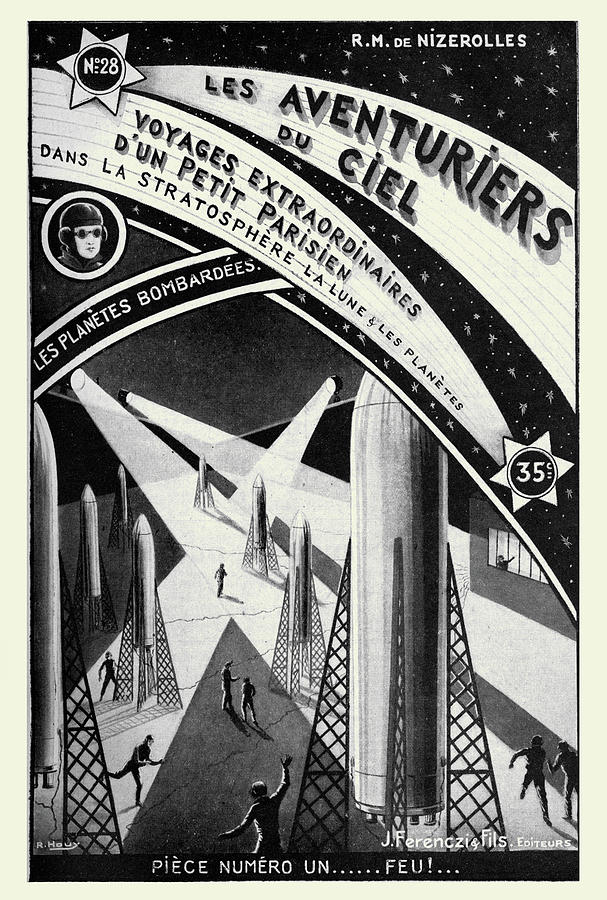
Find the location of a particular element. spotlights is located at coordinates (61, 384), (121, 399), (337, 388).